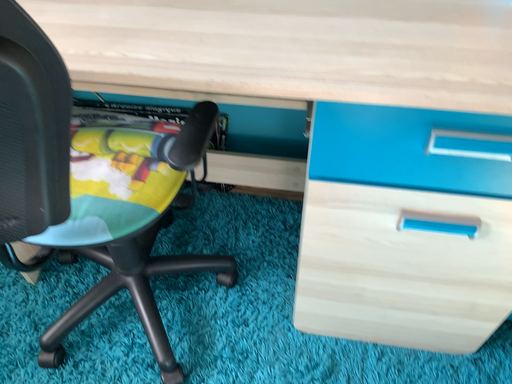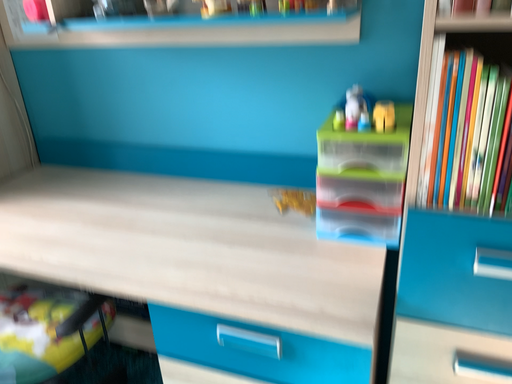
Question: Which way did the camera rotate in the video?

Choices:
 (A) rotated downward
 (B) rotated upward

Answer: (B)